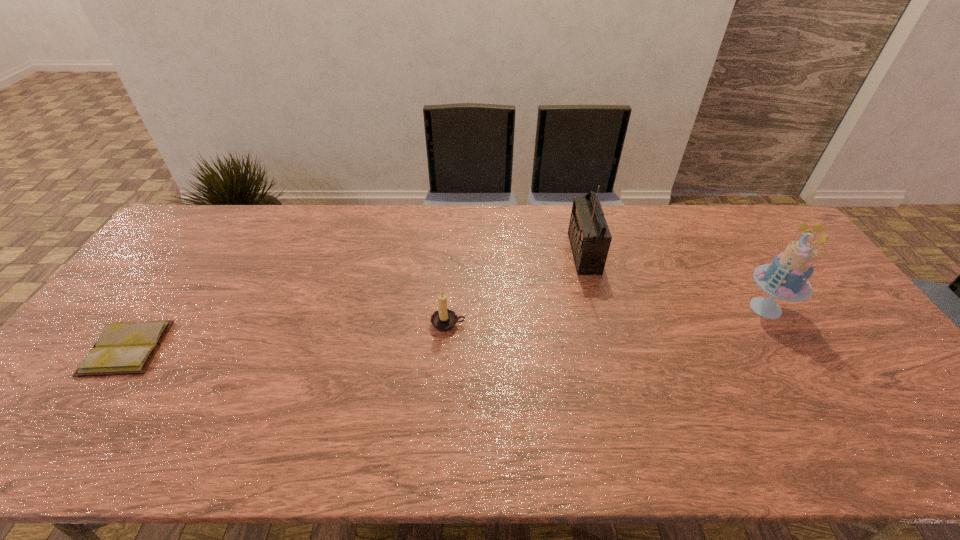
This screenshot has width=960, height=540. What are the coordinates of `free space at the left edge of the desktop` in the screenshot? It's located at (183, 249).

The height and width of the screenshot is (540, 960). In the image, there is a desktop. In order to click on free region at the far left corner in this screenshot , I will do `click(185, 224)`.

In order to click on vacant space that's between the third object from left to right and the rightmost object in this screenshot , I will do `click(675, 280)`.

The height and width of the screenshot is (540, 960). Find the location of `blank region between the third object from left to right and the shortest object`. blank region between the third object from left to right and the shortest object is located at coordinates (355, 301).

Locate an element on the screen. The width and height of the screenshot is (960, 540). unoccupied area between the radio receiver and the cake is located at coordinates (675, 280).

The height and width of the screenshot is (540, 960). What are the coordinates of `free space between the shortest object and the radio receiver` in the screenshot? It's located at (355, 301).

Where is `free space between the cake and the second object from left to right`? free space between the cake and the second object from left to right is located at coordinates (607, 316).

In order to click on free space between the shortest object and the candle holder in this screenshot , I will do point(288,336).

Find the location of a particular element. vacant space that's between the rightmost object and the third object from left to right is located at coordinates (675, 280).

At what (x,y) coordinates should I click in order to perform the action: click on free point between the radio receiver and the leftmost object. Please return your answer as a coordinate pair (x, y). Looking at the image, I should click on (355, 301).